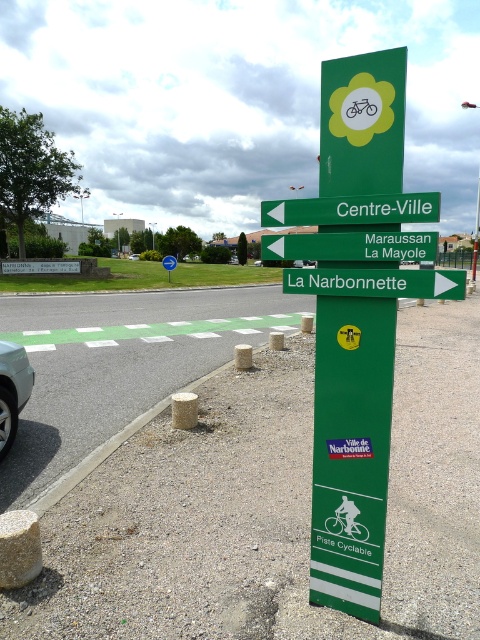
Can you confirm if green plastic sign at center is thinner than white glossy car at center-left?

Indeed, green plastic sign at center has a lesser width compared to white glossy car at center-left.

Looking at this image, between green plastic sign at center and white glossy car at center-left, which one appears on the right side from the viewer's perspective?

green plastic sign at center

Is point (432, 253) in front of point (136, 253)?

Yes, point (432, 253) is closer to viewer.

Image resolution: width=480 pixels, height=640 pixels. I want to click on green plastic sign at center, so click(x=350, y=246).

Does green plastic sign at center-right have a lesser height compared to green plastic sign at center?

Yes.

Does green plastic sign at center-right have a lesser width compared to green plastic sign at center?

Yes, green plastic sign at center-right is thinner than green plastic sign at center.

Is point (442, 289) less distant than point (313, 248)?

Yes.

At what (x,y) coordinates should I click in order to perform the action: click on green plastic sign at center-right. Please return your answer as a coordinate pair (x, y). Looking at the image, I should click on (376, 282).

Can you confirm if green plastic sign at center is positioned below silver metallic car at lower left?

Yes, green plastic sign at center is below silver metallic car at lower left.

Is green plastic sign at center positioned in front of silver metallic car at lower left?

Yes, green plastic sign at center is in front of silver metallic car at lower left.

Does point (369, 234) come closer to viewer compared to point (260, 260)?

That is True.

At what (x,y) coordinates should I click in order to perform the action: click on green plastic sign at center. Please return your answer as a coordinate pair (x, y). This screenshot has height=640, width=480. Looking at the image, I should click on (350, 246).